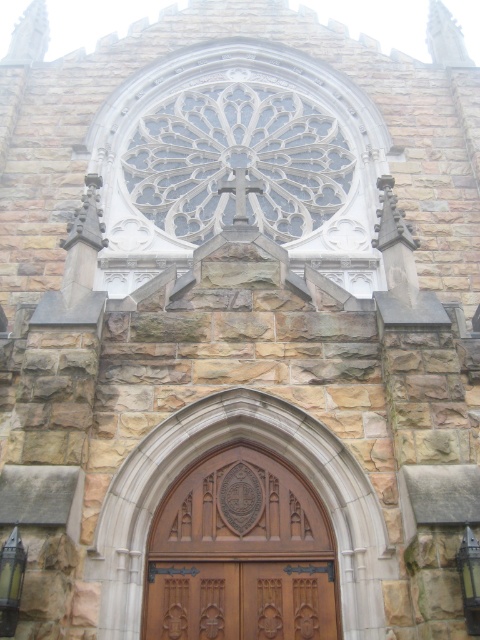
Question: Among these objects, which one is nearest to the camera?

Choices:
 (A) brown wooden door at center
 (B) clear glass cross at upper center

Answer: (A)

Question: In this image, where is clear glass cross at upper center located relative to brown wooden door at center?

Choices:
 (A) above
 (B) below

Answer: (A)

Question: Which of the following is the closest to the observer?

Choices:
 (A) brown wooden door at center
 (B) clear glass cross at upper center

Answer: (A)

Question: Observing the image, what is the correct spatial positioning of clear glass cross at upper center in reference to brown wooden door at center?

Choices:
 (A) right
 (B) left

Answer: (B)

Question: Which point appears closest to the camera in this image?

Choices:
 (A) (286, 614)
 (B) (305, 177)
 (C) (210, 540)

Answer: (A)

Question: In this image, where is clear glass cross at upper center located relative to brown wooden door at center?

Choices:
 (A) right
 (B) left

Answer: (B)